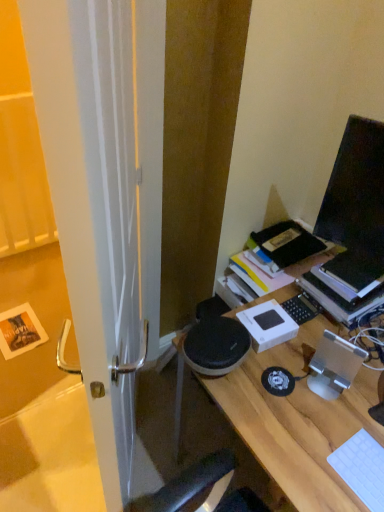
Question: From the image's perspective, is white plastic keyboard at lower right below wooden desk at center?

Choices:
 (A) yes
 (B) no

Answer: (B)

Question: Is white plastic keyboard at lower right to the left of wooden desk at center from the viewer's perspective?

Choices:
 (A) yes
 (B) no

Answer: (A)

Question: Is white plastic keyboard at lower right at the right side of wooden desk at center?

Choices:
 (A) no
 (B) yes

Answer: (A)

Question: Is white plastic keyboard at lower right in contact with wooden desk at center?

Choices:
 (A) no
 (B) yes

Answer: (A)

Question: Does white plastic keyboard at lower right have a greater height compared to wooden desk at center?

Choices:
 (A) yes
 (B) no

Answer: (B)

Question: Is point (178, 398) positioned closer to the camera than point (370, 508)?

Choices:
 (A) farther
 (B) closer

Answer: (A)

Question: From the image's perspective, relative to white plastic keyboard at lower right, is wooden desk at center above or below?

Choices:
 (A) above
 (B) below

Answer: (B)

Question: From a real-world perspective, is wooden desk at center physically located above or below white plastic keyboard at lower right?

Choices:
 (A) below
 (B) above

Answer: (A)

Question: Considering their positions, is wooden desk at center located in front of or behind white plastic keyboard at lower right?

Choices:
 (A) front
 (B) behind

Answer: (B)

Question: From a real-world perspective, is wooden desk at center physically located above or below hardcover book at upper right?

Choices:
 (A) below
 (B) above

Answer: (A)

Question: From the image's perspective, is wooden desk at center positioned above or below hardcover book at upper right?

Choices:
 (A) above
 (B) below

Answer: (B)

Question: In terms of width, does wooden desk at center look wider or thinner when compared to hardcover book at upper right?

Choices:
 (A) wide
 (B) thin

Answer: (A)

Question: Based on their sizes in the image, would you say wooden desk at center is bigger or smaller than hardcover book at upper right?

Choices:
 (A) big
 (B) small

Answer: (A)

Question: Is hardcover book at upper right taller or shorter than black glossy monitor at upper right?

Choices:
 (A) short
 (B) tall

Answer: (A)

Question: From a real-world perspective, is hardcover book at upper right physically located above or below black glossy monitor at upper right?

Choices:
 (A) above
 (B) below

Answer: (B)